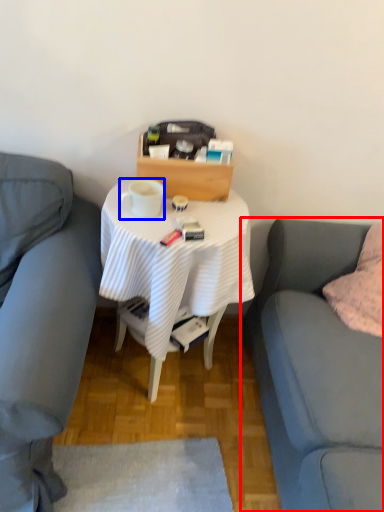
Question: Among these objects, which one is nearest to the camera, studio couch (highlighted by a red box) or coffee cup (highlighted by a blue box)?

Choices:
 (A) studio couch
 (B) coffee cup

Answer: (A)